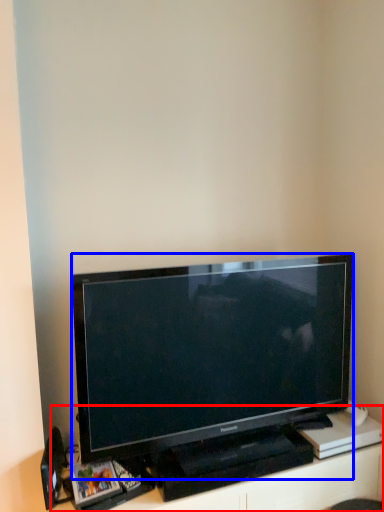
Question: Which object appears closest to the camera in this image, entertainment center (highlighted by a red box) or television (highlighted by a blue box)?

Choices:
 (A) entertainment center
 (B) television

Answer: (B)